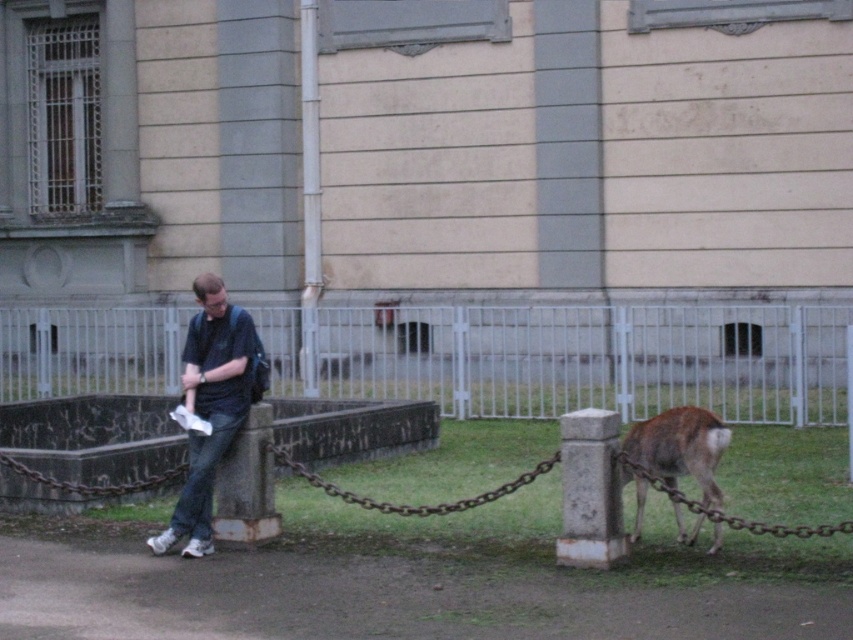
Who is more forward, (x=541, y=346) or (x=339, y=490)?

Point (x=339, y=490)

Is white metal fence at center to the right of rusty metal chain at center from the viewer's perspective?

No, white metal fence at center is not to the right of rusty metal chain at center.

I want to click on white metal fence at center, so click(x=570, y=358).

Locate an element on the screen. The height and width of the screenshot is (640, 853). white metal fence at center is located at coordinates (570, 358).

Which is more to the left, dark blue jeans at left or rusty metal chain at center?

Positioned to the left is dark blue jeans at left.

Between point (250, 358) and point (279, 461), which one is positioned in front?

Point (250, 358) is more forward.

At what (x,y) coordinates should I click in order to perform the action: click on dark blue jeans at left. Please return your answer as a coordinate pair (x, y). Image resolution: width=853 pixels, height=640 pixels. Looking at the image, I should click on (212, 406).

Between white metal fence at center and rusty metal chain at lower right, which one has more height?

white metal fence at center

Is white metal fence at center further to camera compared to rusty metal chain at lower right?

Yes, white metal fence at center is behind rusty metal chain at lower right.

Is point (537, 314) positioned behind point (801, 529)?

Yes, point (537, 314) is behind point (801, 529).

Where is `white metal fence at center`? white metal fence at center is located at coordinates (570, 358).